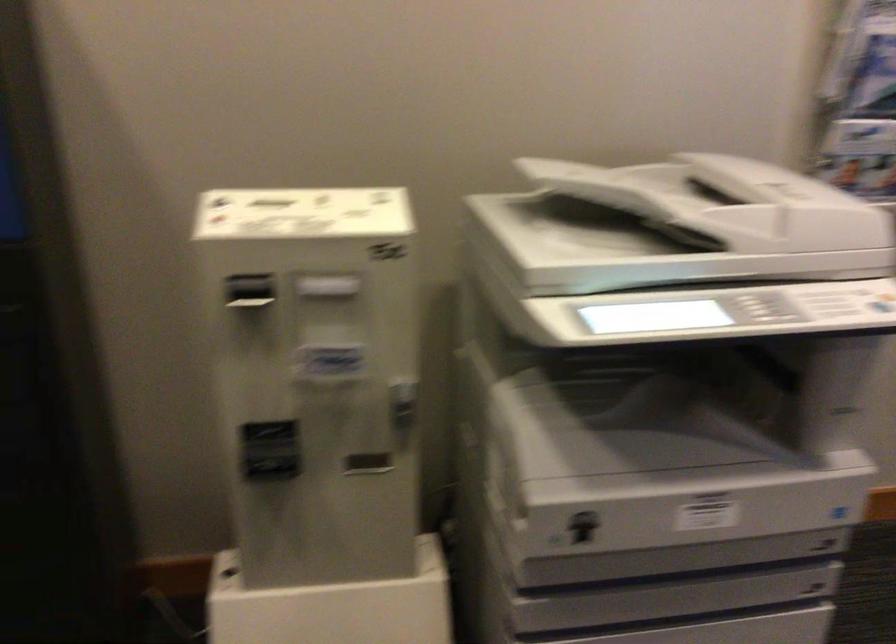
Where would you insert the payment machine slot? Please return your answer as a coordinate pair (x, y).

(250, 292)